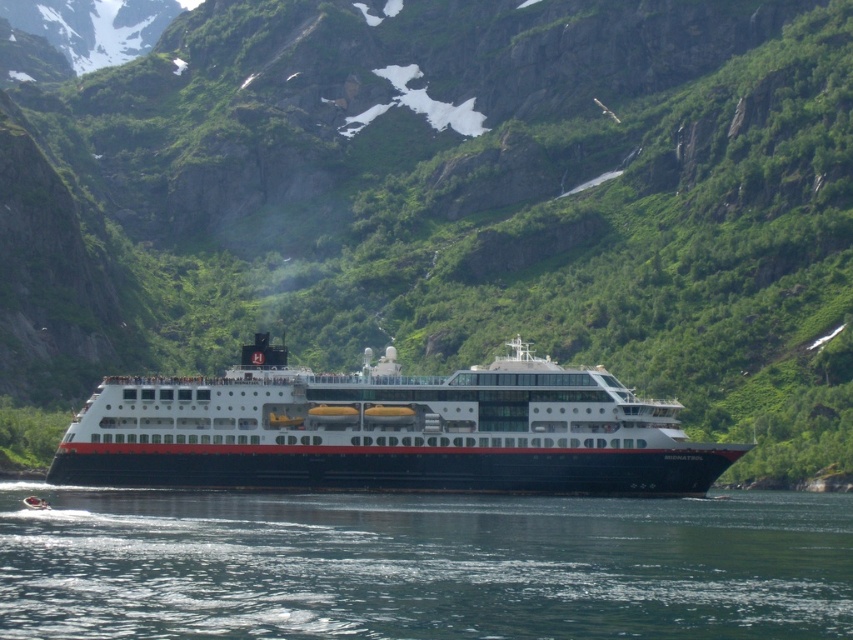
You are a photographer on a helicopter above the fjord. You want to capture a photo where the white glossy cruise ship at center is towering over the clear blue water at lower center. Based on the scene, will the cruise ship appear taller than the water in your photo?

The clear blue water at lower center has a lesser height compared to the white glossy cruise ship at center, so yes, the cruise ship will appear taller than the water in the photo.

You are a photographer planning to take a photo of the cruise ship and the water. Based on the scene, which object should you focus on first if you want to capture both the white glossy cruise ship at center and the clear blue water at lower center in your shot? Explain your reasoning.

You should focus on the white glossy cruise ship at center first because it is larger than the clear blue water at lower center, so capturing its details first ensures it will be sharp in the final image.

You are standing on the deck of the cruise ship and want to take a photo of the point at coordinates (x=572, y=618). If your camera has a maximum focus range of 50 meters, will you be able to capture the point clearly?

The point at coordinates (x=572, y=618) is 51.69 meters away from the camera. Since this distance exceeds the camera maximum focus range of 50 meters, the point will not be captured clearly.